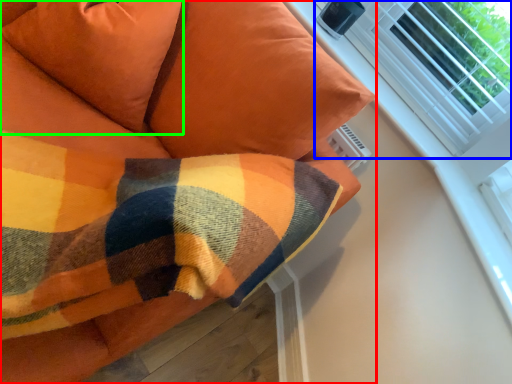
Question: Based on their relative distances, which object is farther from furniture (highlighted by a red box)? Choose from bay window (highlighted by a blue box) and pillow (highlighted by a green box).

Choices:
 (A) bay window
 (B) pillow

Answer: (A)